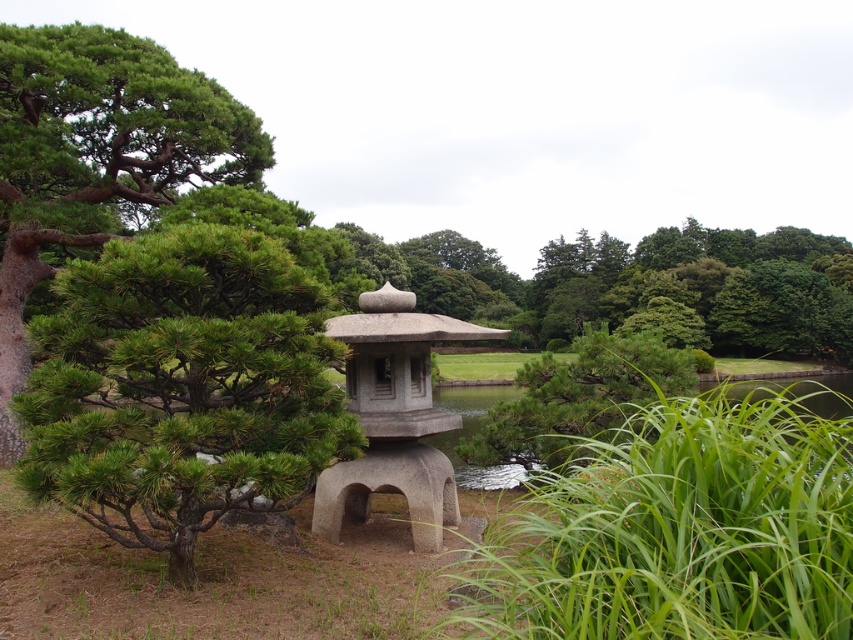
Who is more distant from viewer, (80, 92) or (413, 518)?

Point (80, 92)

Is green textured pine tree at left shorter than gray stone gazebo at center?

No, green textured pine tree at left is not shorter than gray stone gazebo at center.

Describe the element at coordinates (96, 157) in the screenshot. I see `green textured pine tree at left` at that location.

Locate an element on the screen. green textured pine tree at left is located at coordinates (96, 157).

Between green textured stone tree at left and green textured pine tree at left, which one appears on the right side from the viewer's perspective?

Positioned to the right is green textured stone tree at left.

Is green textured stone tree at left further to camera compared to green textured pine tree at left?

No, green textured stone tree at left is in front of green textured pine tree at left.

Does point (341, 396) come closer to viewer compared to point (0, 196)?

Yes, it is in front of point (0, 196).

Locate an element on the screen. Image resolution: width=853 pixels, height=640 pixels. green textured stone tree at left is located at coordinates (183, 387).

From the picture: Who is lower down, green textured stone tree at left or gray stone gazebo at center?

Positioned lower is gray stone gazebo at center.

Which is behind, point (80, 269) or point (448, 476)?

The point (448, 476) is behind.

Does point (68, 278) come closer to viewer compared to point (468, 337)?

Yes, point (68, 278) is in front of point (468, 337).

Find the location of a particular element. The height and width of the screenshot is (640, 853). green textured stone tree at left is located at coordinates (183, 387).